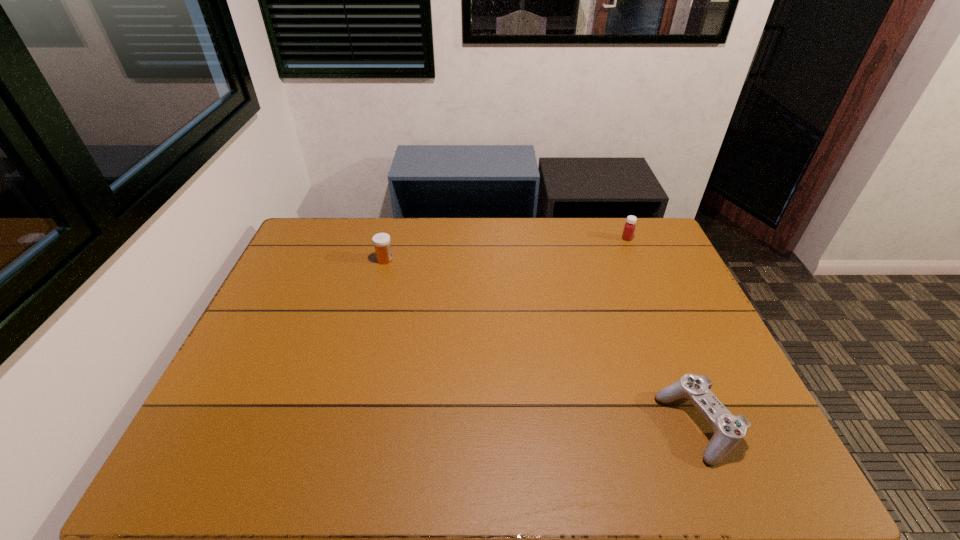
In order to click on the left medicine in this screenshot , I will do `click(381, 241)`.

At what (x,y) coordinates should I click in order to perform the action: click on the nearer medicine. Please return your answer as a coordinate pair (x, y). The width and height of the screenshot is (960, 540). Looking at the image, I should click on (381, 241).

Find the location of a particular element. This screenshot has width=960, height=540. the right medicine is located at coordinates (629, 227).

Find the location of a particular element. The width and height of the screenshot is (960, 540). the farthest object is located at coordinates (629, 227).

In order to click on the nearest object in this screenshot , I will do `click(729, 430)`.

Locate an element on the screen. control is located at coordinates (729, 430).

The image size is (960, 540). I want to click on blank space located on the front of the leftmost object, so click(x=367, y=329).

Identify the location of free region located 0.330m on the front of the farthest object. (656, 307).

At what (x,y) coordinates should I click in order to perform the action: click on free space located on the back of the shortest object. Please return your answer as a coordinate pair (x, y). This screenshot has height=540, width=960. Looking at the image, I should click on (672, 361).

Where is `object that is at the near edge`? The image size is (960, 540). object that is at the near edge is located at coordinates (729, 430).